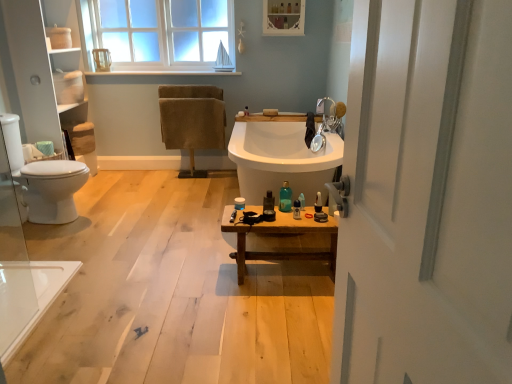
Identify the location of free space in front of matte white container at center, which is the sixth toiletry in right-to-left order. tap(246, 210).